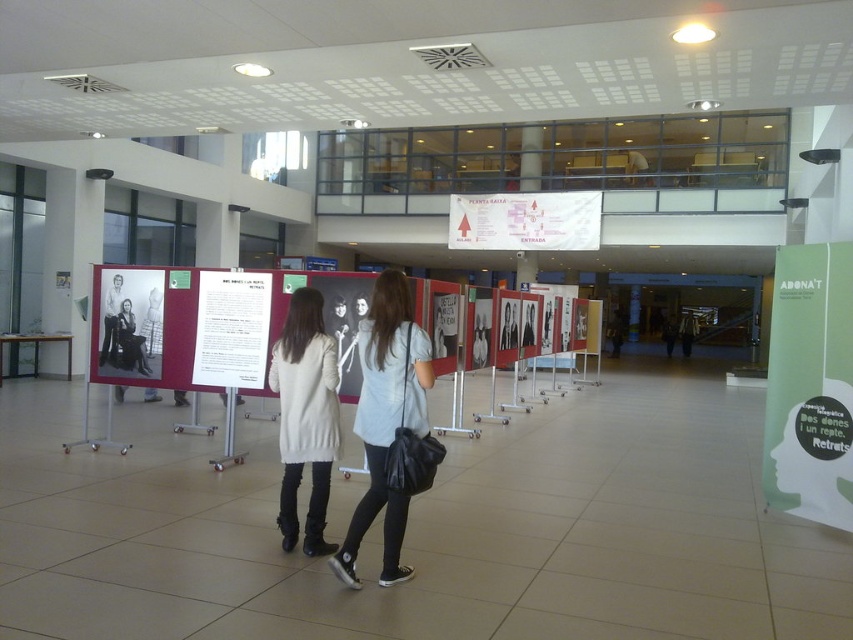
Which is below, green paperboard poster at right or white wool coat at center?

white wool coat at center is lower down.

Between point (795, 280) and point (305, 305), which one is positioned behind?

The point (795, 280) is more distant.

The height and width of the screenshot is (640, 853). I want to click on green paperboard poster at right, so click(x=810, y=385).

Who is shorter, white paper map at center or white paper at center?

white paper at center is shorter.

Does point (462, 195) come closer to viewer compared to point (248, 296)?

No, (462, 195) is behind (248, 296).

You are a GUI agent. You are given a task and a screenshot of the screen. Output one action in this format:
    pyautogui.click(x=<x>, y=<y>)
    Task: Click on the white paper map at center
    This screenshot has height=640, width=853.
    Given the screenshot: What is the action you would take?
    pyautogui.click(x=525, y=221)

Does point (376, 381) come in front of point (198, 353)?

Yes, point (376, 381) is in front of point (198, 353).

Can you confirm if matte gray shirt at center is taller than white paper at center?

Correct, matte gray shirt at center is much taller as white paper at center.

You are a GUI agent. You are given a task and a screenshot of the screen. Output one action in this format:
    pyautogui.click(x=<x>, y=<y>)
    Task: Click on the matte gray shirt at center
    
    Given the screenshot: What is the action you would take?
    pyautogui.click(x=384, y=422)